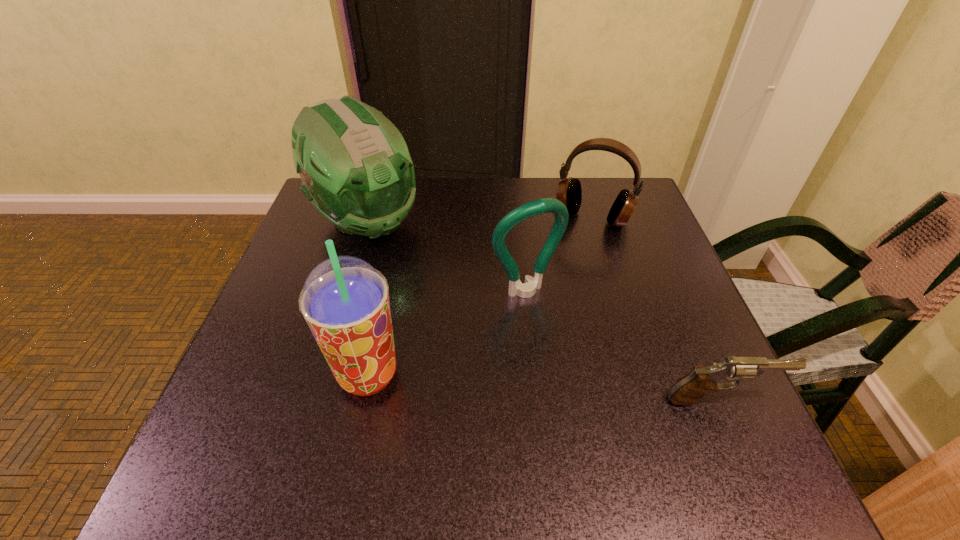
Identify the location of vacant space on the desktop that is between the smoothie and the pistol and is positioned on the visor of the football helmet. The image size is (960, 540). (534, 387).

At what (x,y) coordinates should I click in order to perform the action: click on vacant space on the desktop that is between the smoothie and the shortest object and is positioned on the ear pads of the second shortest object. Please return your answer as a coordinate pair (x, y). Image resolution: width=960 pixels, height=540 pixels. Looking at the image, I should click on (521, 386).

Locate an element on the screen. This screenshot has width=960, height=540. vacant spot on the desktop that is between the smoothie and the pistol and is positioned at the jaws of the bottle opener is located at coordinates (591, 390).